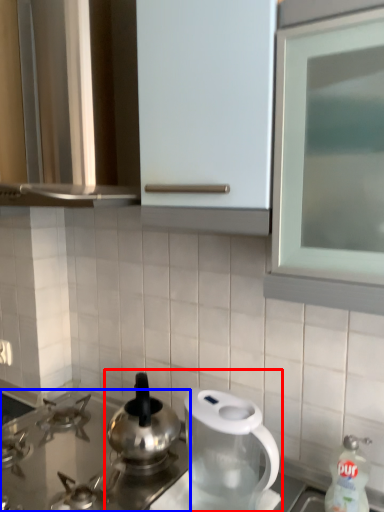
Question: Among these objects, which one is nearest to the camera, tea set (highlighted by a red box) or gas stove (highlighted by a blue box)?

Choices:
 (A) tea set
 (B) gas stove

Answer: (A)